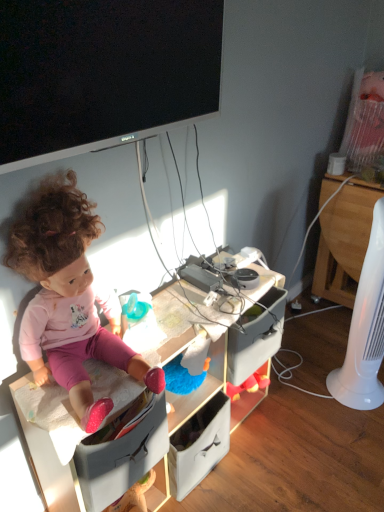
Where is `free space between white plastic fan at right and matte plastic desk at center`? The image size is (384, 512). free space between white plastic fan at right and matte plastic desk at center is located at coordinates (292, 426).